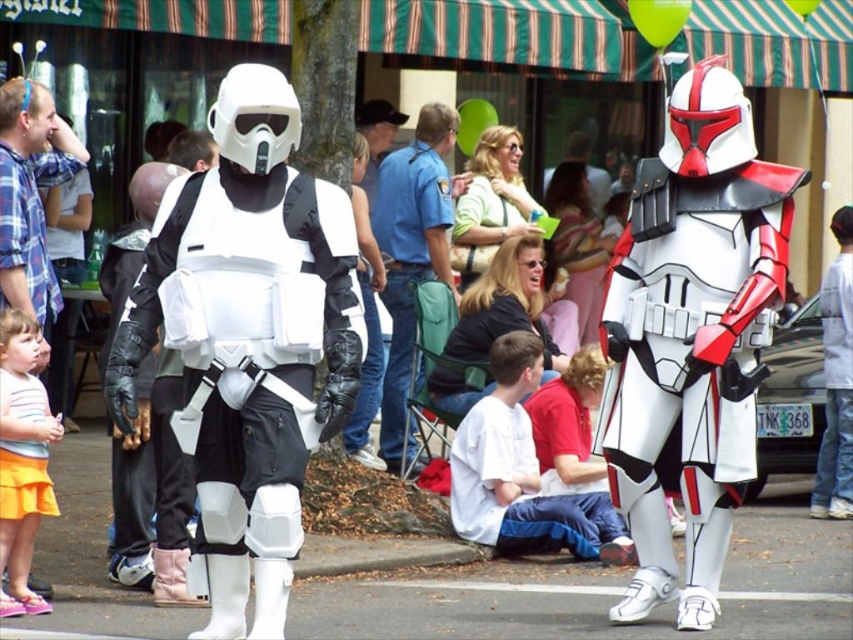
Who is positioned more to the left, white matte/soft fabric at center or blue uniform shirt at center?

From the viewer's perspective, blue uniform shirt at center appears more on the left side.

The height and width of the screenshot is (640, 853). I want to click on white matte/soft fabric at center, so click(521, 492).

Can you confirm if blue uniform shirt at center is positioned to the left of striped shirt and orange skirt at lower left?

No, blue uniform shirt at center is not to the left of striped shirt and orange skirt at lower left.

In the scene shown: Is blue uniform shirt at center above striped shirt and orange skirt at lower left?

Yes, blue uniform shirt at center is above striped shirt and orange skirt at lower left.

Identify the location of blue uniform shirt at center. Image resolution: width=853 pixels, height=640 pixels. (412, 256).

Locate an element on the screen. The height and width of the screenshot is (640, 853). blue uniform shirt at center is located at coordinates (412, 256).

What do you see at coordinates (521, 492) in the screenshot?
I see `white matte/soft fabric at center` at bounding box center [521, 492].

Who is more forward, (598, 518) or (7, 557)?

Point (7, 557)

Between point (585, 528) and point (9, 497), which one is positioned in front?

Point (9, 497) is in front.

You are a GUI agent. You are given a task and a screenshot of the screen. Output one action in this format:
    pyautogui.click(x=<x>, y=<y>)
    Task: Click on the white matte/soft fabric at center
    Image resolution: width=853 pixels, height=640 pixels.
    Given the screenshot: What is the action you would take?
    pyautogui.click(x=521, y=492)